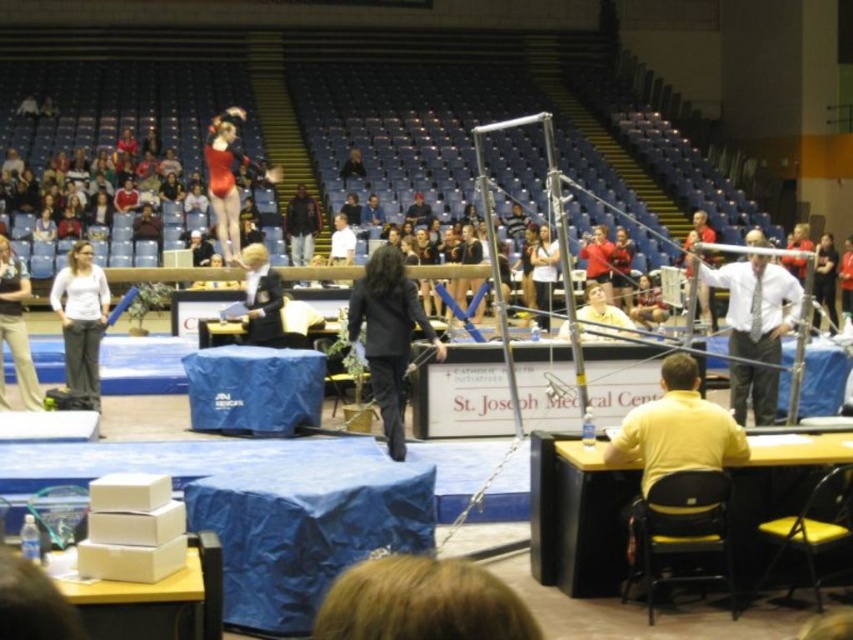
Which object is wider, the black fabric jacket at center or the light brown hair at upper center?

The black fabric jacket at center is wider than the light brown hair at upper center according to the description provided.

You are a photographer positioned at the back of the arena. You need to capture a photo of both the yellow smooth shirt at lower right and the white shirt at center. Which shirt will appear wider in the photo?

The white shirt at center will appear wider in the photo because the yellow smooth shirt at lower right is narrower than the white shirt at center.

You are a photographer positioned at the back of the arena. You need to capture a photo of both the yellow smooth shirt at lower right and the white shirt at center. Which shirt will appear smaller in the photo?

The yellow smooth shirt at lower right will appear smaller in the photo because it is not as tall as the white shirt at center, meaning it is closer to the photographer.